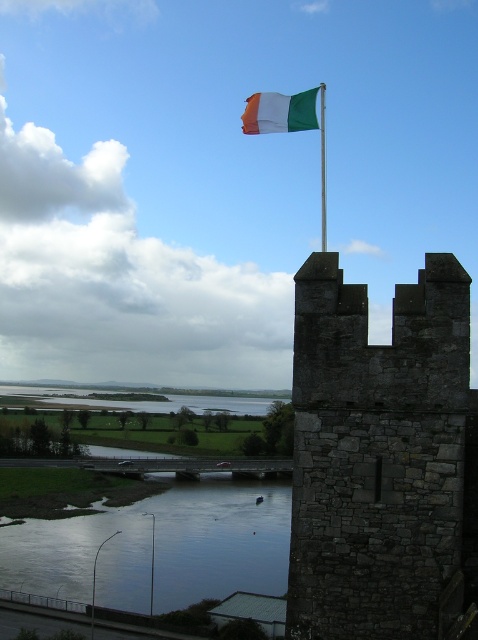
Question: Which point appears farthest from the camera in this image?

Choices:
 (A) (106, 540)
 (B) (445, 376)
 (C) (152, 577)
 (D) (126, 552)

Answer: (A)

Question: Is green fabric flag pole at upper center to the left of metallic pole at lower left from the viewer's perspective?

Choices:
 (A) no
 (B) yes

Answer: (A)

Question: Observing the image, what is the correct spatial positioning of dark gray stone tower at center-right in reference to smooth reflective water at lower center?

Choices:
 (A) right
 (B) left

Answer: (A)

Question: Which is nearer to the white cotton flag at upper center?

Choices:
 (A) dark gray stone tower at center-right
 (B) green fabric flag pole at upper center
 (C) smooth reflective water at lower center
 (D) metallic pole at lower left

Answer: (A)

Question: Based on their relative distances, which object is nearer to the smooth reflective water at lower center?

Choices:
 (A) white cotton flag at upper center
 (B) metallic flagpole at upper center
 (C) green fabric flag pole at upper center

Answer: (B)

Question: Is the position of smooth reflective water at lower center less distant than that of metallic pole at lower left?

Choices:
 (A) no
 (B) yes

Answer: (A)